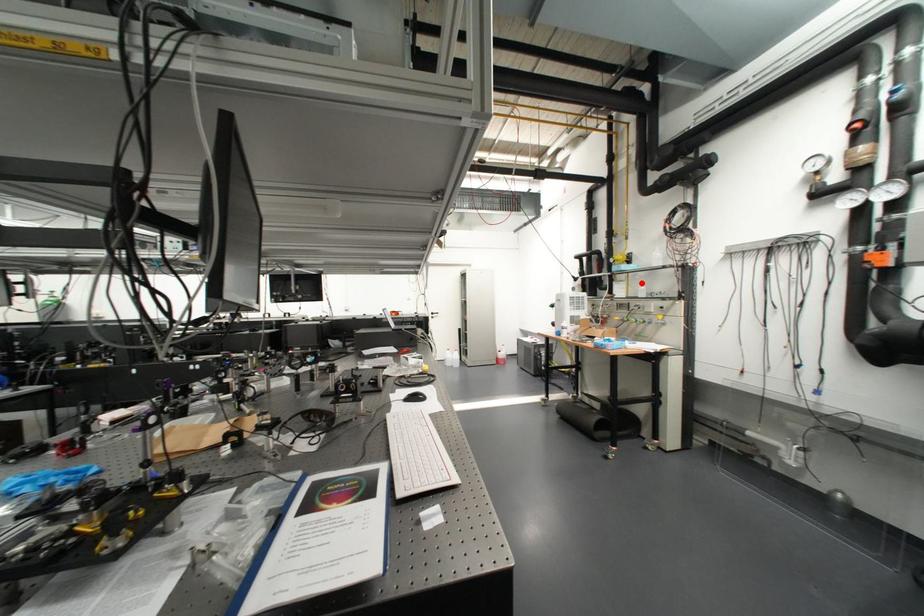
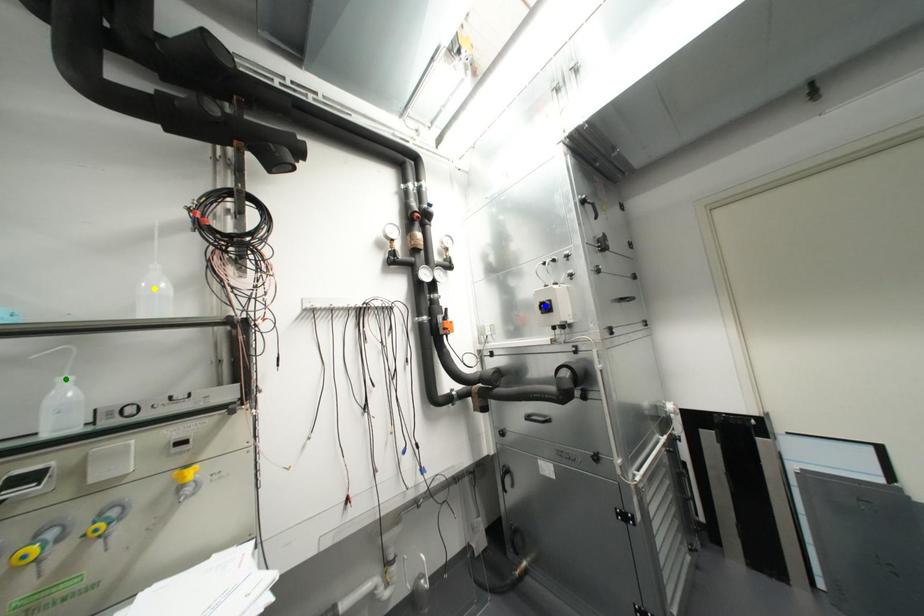
Question: I am providing you with two images of the same scene from different viewpoints. A red point is marked on the first image. You are given multiple points on the second image. Which mark in image 2 goes with the point in image 1?

Choices:
 (A) yellow point
 (B) blue point
 (C) green point

Answer: (C)